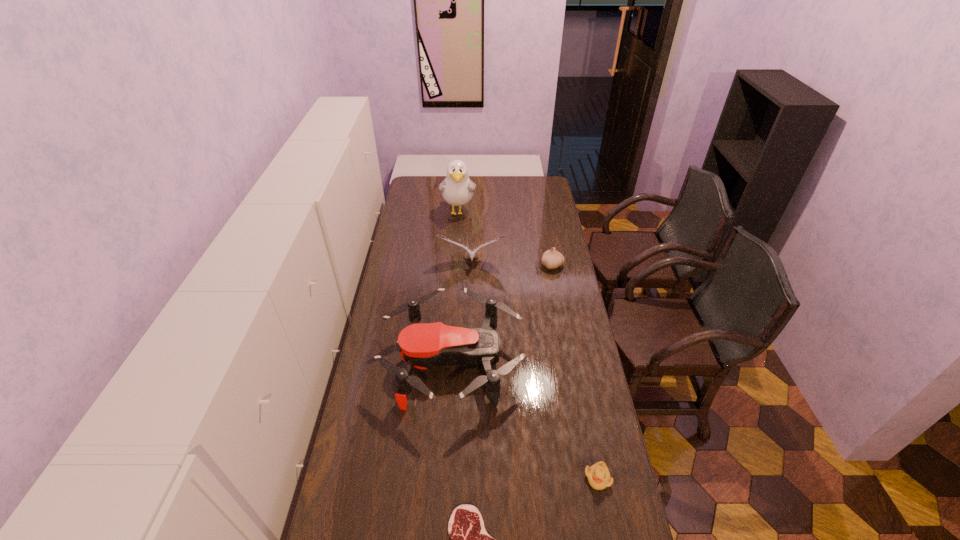
Image resolution: width=960 pixels, height=540 pixels. Identify the location of vacant area that lies between the third nearest object and the duckling. (525, 420).

Identify the location of free space between the nearer gull and the taller gull. (466, 238).

Locate an element on the screen. empty space between the garlic and the second nearest object is located at coordinates (575, 372).

Locate an element on the screen. empty space between the shorter gull and the farthest object is located at coordinates (466, 238).

Identify the location of object that is the fourth closest to the taller gull. (598, 475).

At what (x,y) coordinates should I click in order to perform the action: click on object that stands as the closest to the garlic. Please return your answer as a coordinate pair (x, y). Looking at the image, I should click on (471, 253).

Identify the location of free space that satisfies the following two spatial constraints: 1. at the tip of the beak of the nearer gull; 2. on the right side of the garlic. (472, 265).

Where is `free space that satisfies the following two spatial constraints: 1. at the tip of the beak of the nearer gull; 2. on the camera side of the drone`? Image resolution: width=960 pixels, height=540 pixels. free space that satisfies the following two spatial constraints: 1. at the tip of the beak of the nearer gull; 2. on the camera side of the drone is located at coordinates (470, 362).

The width and height of the screenshot is (960, 540). What are the coordinates of `vacant area that satisfies the following two spatial constraints: 1. on the beak of the garlic; 2. on the left side of the taller gull` in the screenshot? It's located at (455, 265).